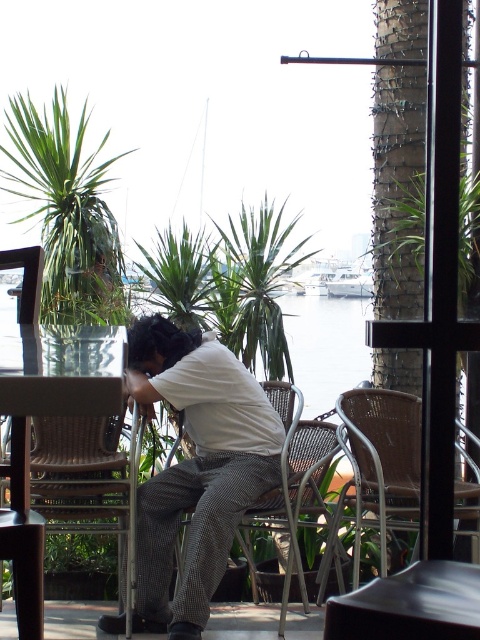
Does white cotton shirt at center have a smaller size compared to green leafy plant at upper left?

Yes, white cotton shirt at center is smaller than green leafy plant at upper left.

Can you confirm if white cotton shirt at center is positioned below green leafy plant at upper left?

Yes, white cotton shirt at center is below green leafy plant at upper left.

You are a GUI agent. You are given a task and a screenshot of the screen. Output one action in this format:
    pyautogui.click(x=<x>, y=<y>)
    Task: Click on the white cotton shirt at center
    The height and width of the screenshot is (640, 480).
    Given the screenshot: What is the action you would take?
    pyautogui.click(x=195, y=467)

Which is below, green leafy plant at center or woven wicker chair at center?

woven wicker chair at center is below.

Is point (242, 340) positioned after point (334, 429)?

Yes, it is behind point (334, 429).

The height and width of the screenshot is (640, 480). Find the location of `green leafy plant at center`. green leafy plant at center is located at coordinates (254, 285).

Where is `green leafy plant at center`? green leafy plant at center is located at coordinates (254, 285).

Is point (7, 509) positioned behind point (402, 412)?

No, it is not.

Who is more forward, [36,605] or [412,529]?

Point [36,605] is more forward.

Is point (36, 371) farther from viewer compared to point (383, 404)?

No, (36, 371) is in front of (383, 404).

This screenshot has width=480, height=640. I want to click on wooden table at left, so click(x=60, y=374).